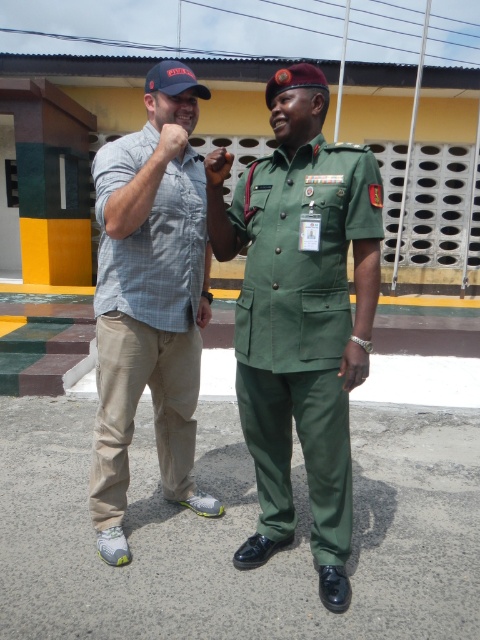
Does green fabric uniform at center have a greater height compared to matte gray shirt at upper left?

Yes, green fabric uniform at center is taller than matte gray shirt at upper left.

Is green fabric uniform at center smaller than matte gray shirt at upper left?

Incorrect, green fabric uniform at center is not smaller in size than matte gray shirt at upper left.

This screenshot has width=480, height=640. What do you see at coordinates (300, 326) in the screenshot? I see `green fabric uniform at center` at bounding box center [300, 326].

You are a GUI agent. You are given a task and a screenshot of the screen. Output one action in this format:
    pyautogui.click(x=<x>, y=<y>)
    Task: Click on the green fabric uniform at center
    Image resolution: width=480 pixels, height=640 pixels.
    Given the screenshot: What is the action you would take?
    pyautogui.click(x=300, y=326)

Consider the image. Is light brown cotton pants at left positioned at the back of matte gray shirt at upper left?

No, it is in front of matte gray shirt at upper left.

Between light brown cotton pants at left and matte gray shirt at upper left, which one has less height?

Standing shorter between the two is matte gray shirt at upper left.

The height and width of the screenshot is (640, 480). Find the location of `light brown cotton pants at left`. light brown cotton pants at left is located at coordinates (149, 305).

Between green fabric uniform at center and light brown cotton pants at left, which one has more height?

light brown cotton pants at left is taller.

From the picture: Between green fabric uniform at center and light brown cotton pants at left, which one is positioned lower?

green fabric uniform at center is below.

Describe the element at coordinates (300, 326) in the screenshot. The image size is (480, 640). I see `green fabric uniform at center` at that location.

Locate an element on the screen. green fabric uniform at center is located at coordinates (300, 326).